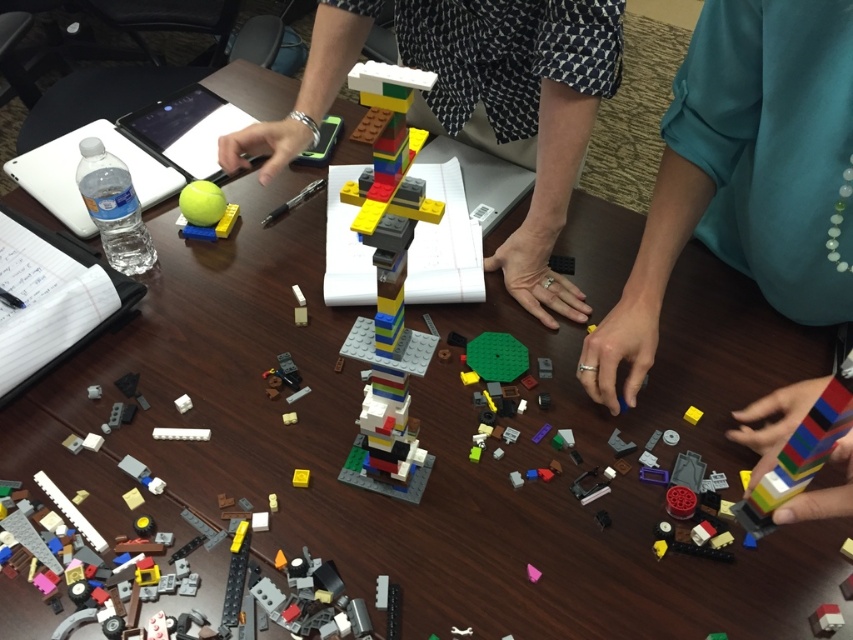
Question: Which object is farther from the camera taking this photo?

Choices:
 (A) multicolored plastic tower at center
 (B) teal fabric hand at center right
 (C) multicolored plastic blocks at center

Answer: (B)

Question: Which point is farther to the camera?

Choices:
 (A) multicolored plastic tower at center
 (B) multicolored plastic blocks at center
 (C) multicolored plastic lego tower at center

Answer: (C)

Question: Is teal fabric hand at center right thinner than multicolored plastic lego tower at center?

Choices:
 (A) yes
 (B) no

Answer: (A)

Question: Which object is farther from the camera taking this photo?

Choices:
 (A) yellow rubber ball at upper left
 (B) multicolored plastic tower at center
 (C) teal fabric hand at center right
 (D) multicolored plastic lego tower at center

Answer: (A)

Question: Does teal fabric hand at center right have a greater width compared to multicolored plastic tower at center?

Choices:
 (A) yes
 (B) no

Answer: (A)

Question: From the image, what is the correct spatial relationship of teal fabric hand at center right in relation to multicolored plastic tower at center?

Choices:
 (A) right
 (B) left

Answer: (A)